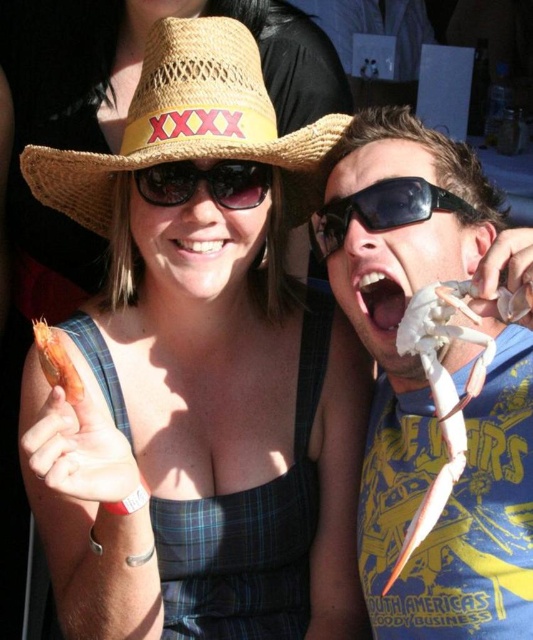
Question: Which point is farther to the camera?

Choices:
 (A) (414, 237)
 (B) (375, 282)
 (C) (423, 500)

Answer: (B)

Question: Observing the image, what is the correct spatial positioning of black reflective sunglasses at upper center in reference to orange matte shrimp at upper left?

Choices:
 (A) below
 (B) above

Answer: (B)

Question: Is straw hat at upper center positioned in front of white matte teeth at center?

Choices:
 (A) yes
 (B) no

Answer: (A)

Question: Estimate the real-world distances between objects in this image. Which object is closer to the black plastic goggles at upper center?

Choices:
 (A) white glossy teeth at center
 (B) straw hat at upper left

Answer: (A)

Question: Which object is the farthest from the white glossy teeth at center?

Choices:
 (A) orange matte shrimp at upper left
 (B) black reflective sunglasses at upper center
 (C) white matte crab claw at right

Answer: (C)

Question: Is straw hat at upper center bigger than white matte crab claw at right?

Choices:
 (A) yes
 (B) no

Answer: (A)